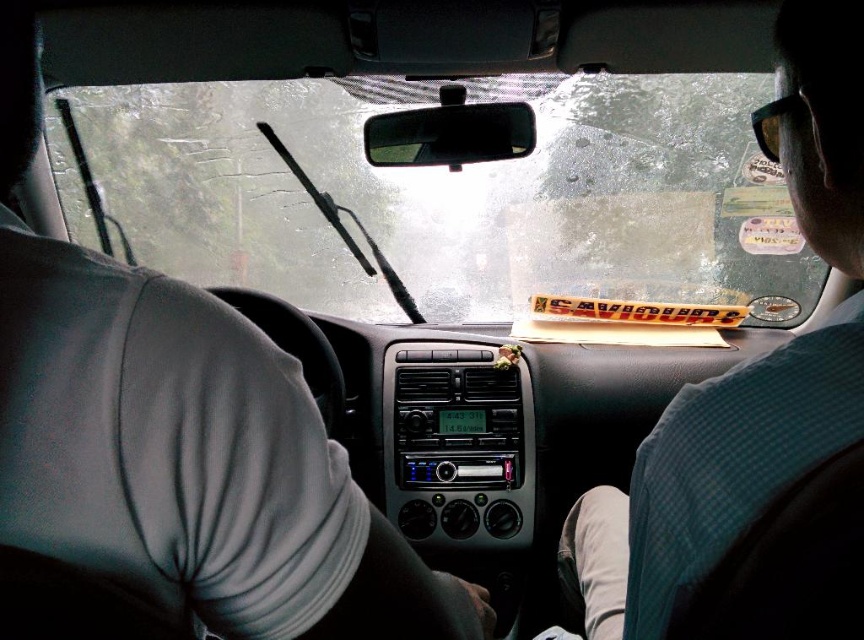
Question: Is transparent glass windshield at center thinner than green checkered shirt at upper right?

Choices:
 (A) yes
 (B) no

Answer: (B)

Question: Can you confirm if transparent glass windshield at center is positioned to the right of green checkered shirt at upper right?

Choices:
 (A) no
 (B) yes

Answer: (A)

Question: Which point appears closest to the camera in this image?

Choices:
 (A) (833, 13)
 (B) (732, 106)

Answer: (A)

Question: Which point is closer to the camera taking this photo?

Choices:
 (A) (830, 202)
 (B) (295, 109)

Answer: (A)

Question: Which point appears closest to the camera in this image?

Choices:
 (A) (341, 276)
 (B) (792, 19)

Answer: (B)

Question: In this image, where is transparent glass windshield at center located relative to green checkered shirt at upper right?

Choices:
 (A) right
 (B) left

Answer: (B)